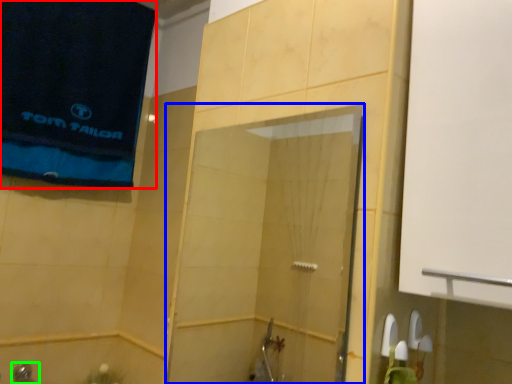
Question: Considering the real-world distances, which object is closest to beach towel (highlighted by a red box)? screen door (highlighted by a blue box) or shower (highlighted by a green box).

Choices:
 (A) screen door
 (B) shower

Answer: (A)